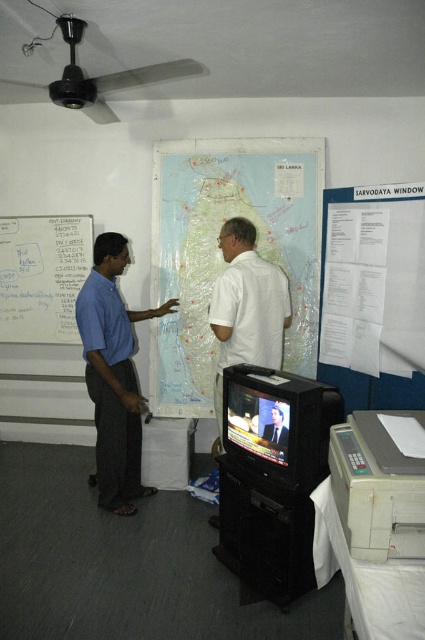
Question: Can you confirm if transparent plastic map at center is wider than smooth white shirt at center?

Choices:
 (A) no
 (B) yes

Answer: (B)

Question: Is transparent plastic map at center thinner than smooth white shirt at center?

Choices:
 (A) yes
 (B) no

Answer: (B)

Question: Is whiteboard at left closer to camera compared to smooth white shirt at center?

Choices:
 (A) no
 (B) yes

Answer: (A)

Question: Which object is farther from the camera taking this photo?

Choices:
 (A) whiteboard at left
 (B) transparent plastic map at center
 (C) blue cotton shirt at left

Answer: (A)

Question: Which is farther from the smooth white shirt at center?

Choices:
 (A) blue cotton shirt at left
 (B) transparent plastic map at center
 (C) whiteboard at left

Answer: (C)

Question: Which of the following is the closest to the observer?

Choices:
 (A) (122, 426)
 (B) (84, 273)

Answer: (A)